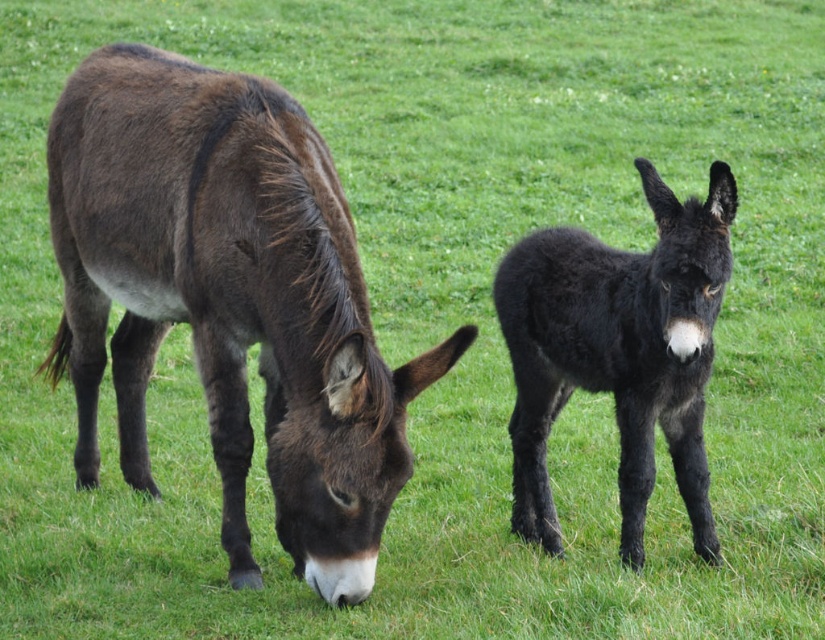
Question: Is dark brown fur donkey at left positioned behind black fuzzy donkey at center?

Choices:
 (A) yes
 (B) no

Answer: (B)

Question: Which object is farther from the camera taking this photo?

Choices:
 (A) dark brown fur donkey at left
 (B) black fuzzy donkey at center

Answer: (B)

Question: Where is dark brown fur donkey at left located in relation to black fuzzy donkey at center in the image?

Choices:
 (A) below
 (B) above

Answer: (B)

Question: Is dark brown fur donkey at left wider than black fuzzy donkey at center?

Choices:
 (A) yes
 (B) no

Answer: (A)

Question: Which point is closer to the camera?

Choices:
 (A) (687, 477)
 (B) (330, 211)

Answer: (B)

Question: Which point is farther from the camera taking this photo?

Choices:
 (A) (568, 326)
 (B) (342, 456)

Answer: (A)